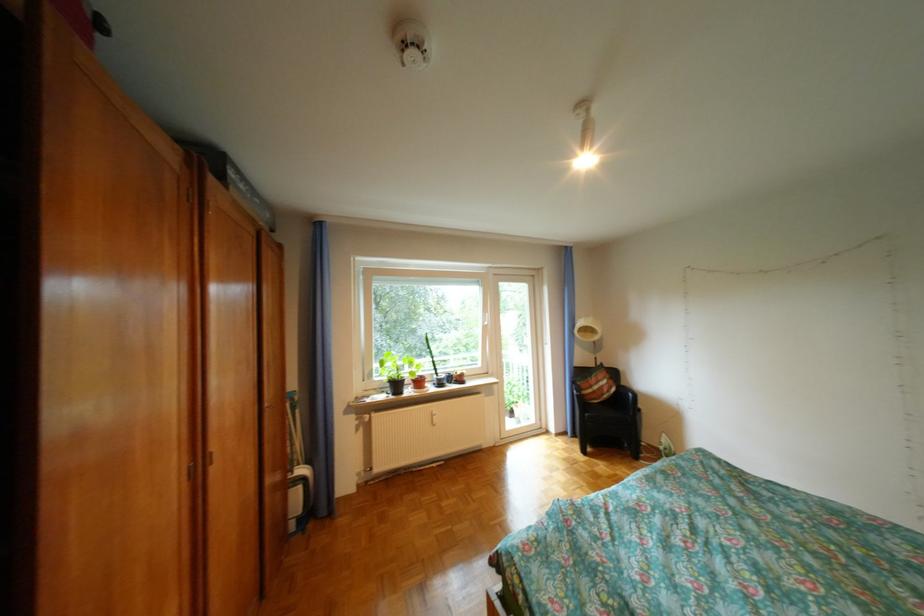
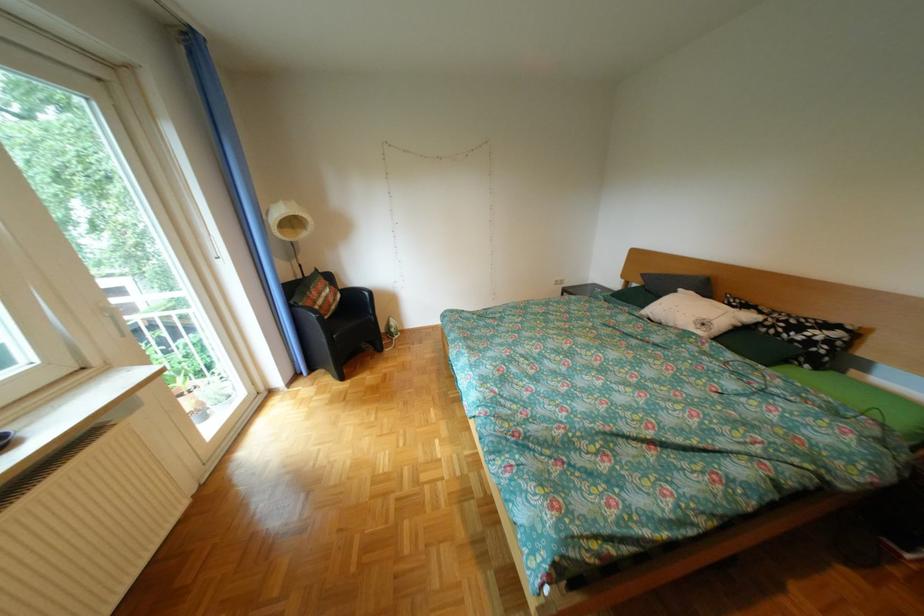
In the second image, find the point that corresponds to the point at 588,383 in the first image.

(306, 307)